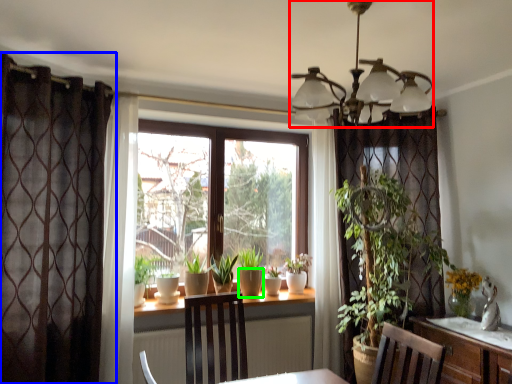
Question: Which is farther away from light fixture (highlighted by a red box)? curtain (highlighted by a blue box) or flowerpot (highlighted by a green box)?

Choices:
 (A) curtain
 (B) flowerpot

Answer: (B)